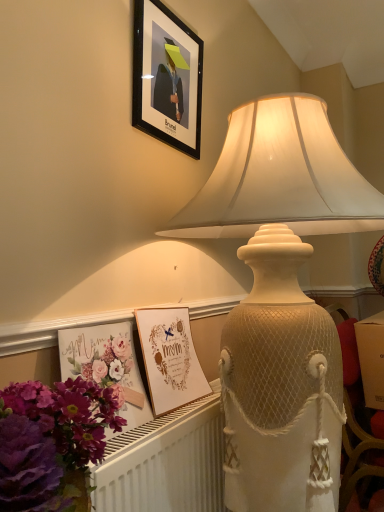
Question: Is matte cream lampshade at upper center at the right side of white textured radiator at lower left?

Choices:
 (A) no
 (B) yes

Answer: (B)

Question: From the image's perspective, is matte cream lampshade at upper center under white textured radiator at lower left?

Choices:
 (A) no
 (B) yes

Answer: (A)

Question: Is matte cream lampshade at upper center outside of white textured radiator at lower left?

Choices:
 (A) no
 (B) yes

Answer: (B)

Question: Is matte cream lampshade at upper center behind white textured radiator at lower left?

Choices:
 (A) no
 (B) yes

Answer: (A)

Question: Can you confirm if matte cream lampshade at upper center is wider than white textured radiator at lower left?

Choices:
 (A) yes
 (B) no

Answer: (A)

Question: Considering their positions, is white textured radiator at lower left located in front of or behind purple floral bouquet at lower left?

Choices:
 (A) behind
 (B) front

Answer: (A)

Question: Looking at their shapes, would you say white textured radiator at lower left is wider or thinner than purple floral bouquet at lower left?

Choices:
 (A) wide
 (B) thin

Answer: (B)

Question: From a real-world perspective, is white textured radiator at lower left physically located above or below purple floral bouquet at lower left?

Choices:
 (A) below
 (B) above

Answer: (A)

Question: Is white textured radiator at lower left bigger or smaller than purple floral bouquet at lower left?

Choices:
 (A) big
 (B) small

Answer: (A)

Question: From their relative heights in the image, would you say black matte picture frame at upper center is taller or shorter than matte gold postcard at lower center, which is counted as the 1th postcard, starting from the back?

Choices:
 (A) short
 (B) tall

Answer: (B)

Question: Considering the positions of point (142, 130) and point (145, 351), is point (142, 130) closer or farther from the camera than point (145, 351)?

Choices:
 (A) farther
 (B) closer

Answer: (A)

Question: From a real-world perspective, is black matte picture frame at upper center above or below matte gold postcard at lower center, arranged as the 2th postcard when viewed from the front?

Choices:
 (A) below
 (B) above

Answer: (B)

Question: Is black matte picture frame at upper center wider or thinner than matte gold postcard at lower center, which is counted as the 1th postcard, starting from the back?

Choices:
 (A) thin
 (B) wide

Answer: (A)

Question: Is matte gold postcard at lower center, arranged as the 2th postcard when viewed from the front, to the left or to the right of purple floral bouquet at lower left in the image?

Choices:
 (A) right
 (B) left

Answer: (A)

Question: From a real-world perspective, is matte gold postcard at lower center, arranged as the 2th postcard when viewed from the front, positioned above or below purple floral bouquet at lower left?

Choices:
 (A) above
 (B) below

Answer: (A)